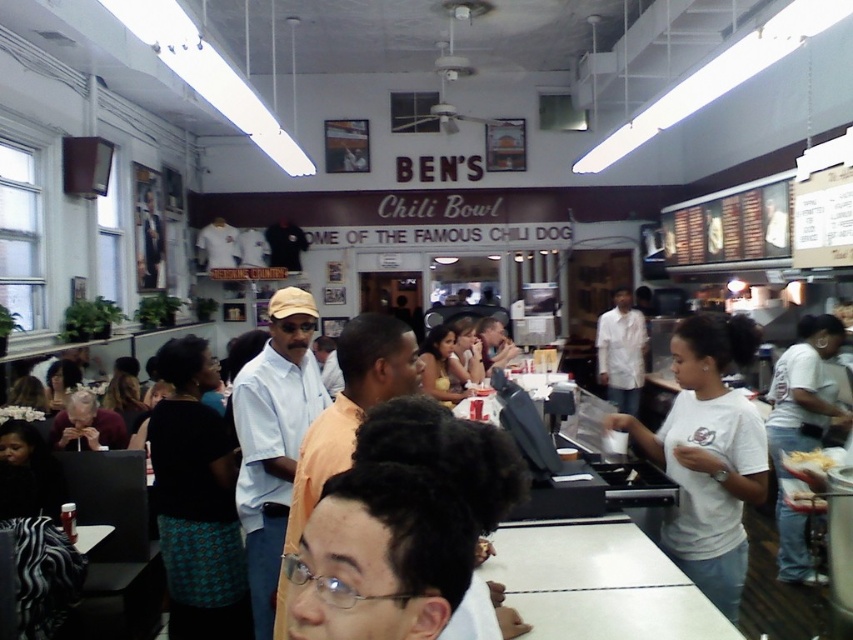
How much distance is there between black textured skirt at center and white paper bag at center?

The distance of black textured skirt at center from white paper bag at center is 9.78 feet.

Can you confirm if black textured skirt at center is wider than white paper bag at center?

Indeed, black textured skirt at center has a greater width compared to white paper bag at center.

Who is more forward, (161, 417) or (802, 460)?

Positioned in front is point (161, 417).

Locate an element on the screen. black textured skirt at center is located at coordinates (196, 500).

Can you confirm if matte white shirt at center is positioned above white paper bag at center?

Correct, matte white shirt at center is located above white paper bag at center.

Looking at this image, measure the distance between matte white shirt at center and white paper bag at center.

matte white shirt at center and white paper bag at center are 2.22 meters apart from each other.

Which is behind, point (436, 352) or point (824, 451)?

The point (436, 352) is more distant.

Locate an element on the screen. matte white shirt at center is located at coordinates (440, 365).

Based on the photo, which is below, black textured skirt at center or matte white shirt at center?

black textured skirt at center

Which is more to the right, black textured skirt at center or matte white shirt at center?

matte white shirt at center is more to the right.

Where is `black textured skirt at center`? black textured skirt at center is located at coordinates (196, 500).